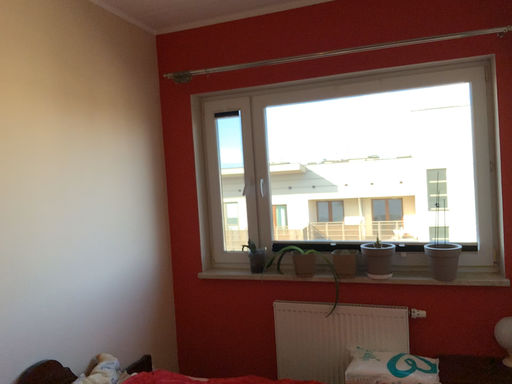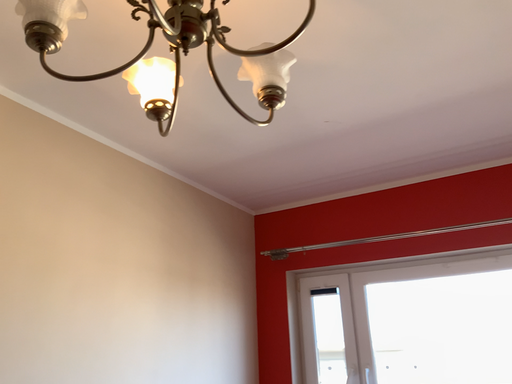
Question: How did the camera likely rotate when shooting the video?

Choices:
 (A) rotated upward
 (B) rotated downward

Answer: (A)